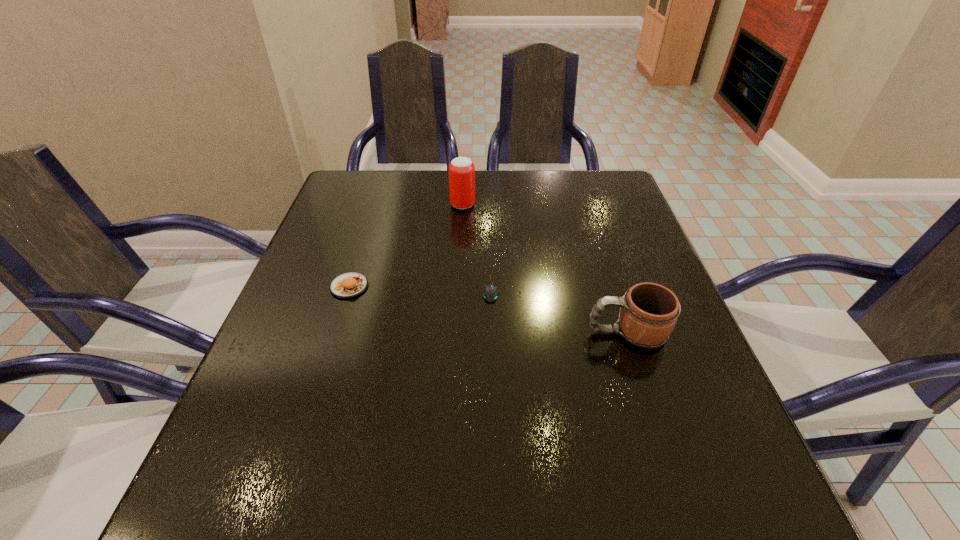
This screenshot has height=540, width=960. In order to click on beer can in this screenshot , I will do `click(461, 169)`.

Locate an element on the screen. This screenshot has height=540, width=960. the third object from right to left is located at coordinates (461, 169).

The height and width of the screenshot is (540, 960). Find the location of `mug`. mug is located at coordinates (649, 312).

Identify the location of the nearest object. (649, 312).

The width and height of the screenshot is (960, 540). In order to click on the second shortest object in this screenshot , I will do `click(351, 284)`.

You are a GUI agent. You are given a task and a screenshot of the screen. Output one action in this format:
    pyautogui.click(x=<x>, y=<y>)
    Task: Click on the leftmost object
    
    Given the screenshot: What is the action you would take?
    pyautogui.click(x=351, y=284)

What are the coordinates of `the second object from right to left` in the screenshot? It's located at (490, 294).

You are a GUI agent. You are given a task and a screenshot of the screen. Output one action in this format:
    pyautogui.click(x=<x>, y=<y>)
    Task: Click on the mouse
    The height and width of the screenshot is (540, 960).
    Given the screenshot: What is the action you would take?
    pyautogui.click(x=490, y=294)

In order to click on free region located on the left of the beer can in this screenshot , I will do `click(375, 205)`.

The width and height of the screenshot is (960, 540). Find the location of `vacant area located 0.400m on the side of the second tallest object with the handle`. vacant area located 0.400m on the side of the second tallest object with the handle is located at coordinates (378, 333).